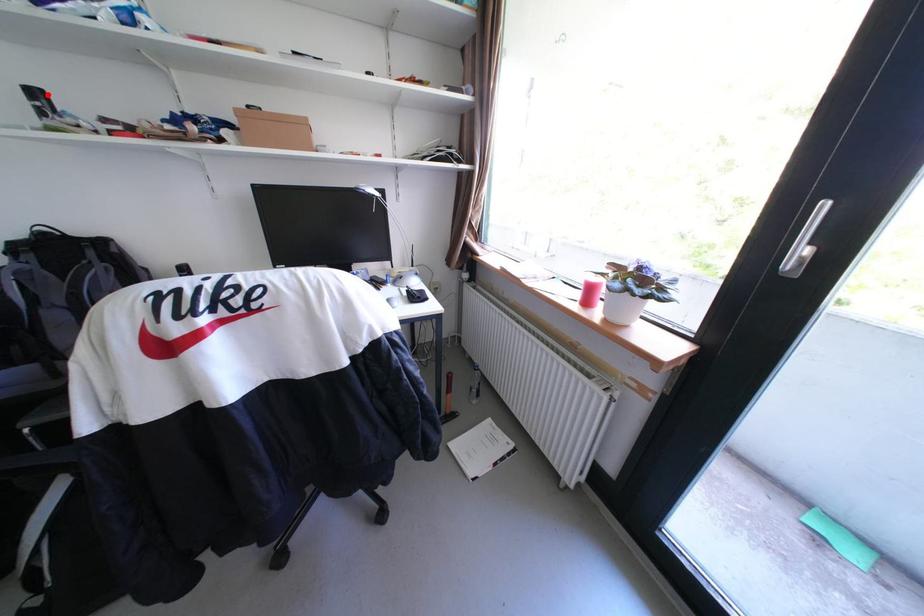
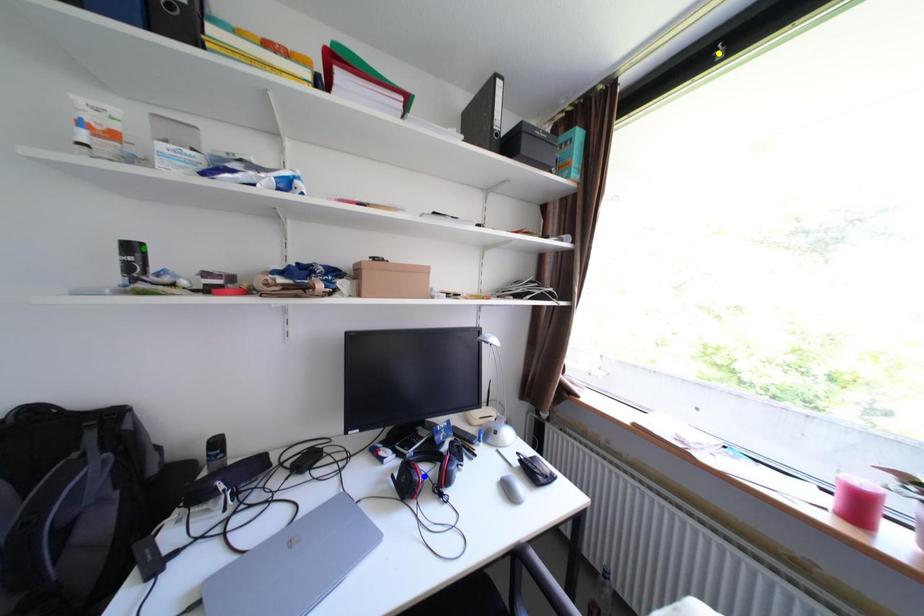
Question: I am providing you with two images of the same scene from different viewpoints. A red point is marked on the first image. You are given multiple points on the second image. Which mark in image 2 goes with the point in image 1?

Choices:
 (A) blue point
 (B) yellow point
 (C) green point

Answer: (C)